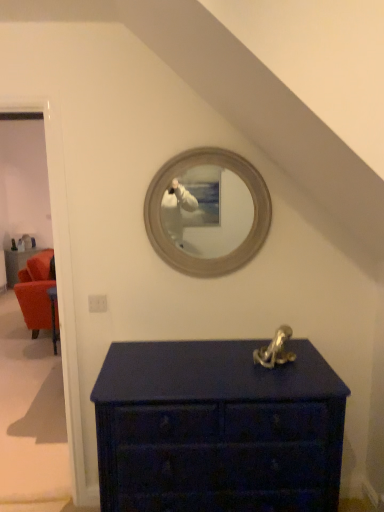
This screenshot has height=512, width=384. I want to click on matte white door at left, so click(60, 271).

What do you see at coordinates (217, 429) in the screenshot?
I see `matte dark blue chest of drawers at lower center` at bounding box center [217, 429].

In order to click on matte white door at left in this screenshot , I will do `click(60, 271)`.

In terms of width, does velvet orange armchair at left look wider or thinner when compared to matte dark blue chest of drawers at lower center?

In the image, velvet orange armchair at left appears to be more narrow than matte dark blue chest of drawers at lower center.

Is the depth of velvet orange armchair at left less than that of matte dark blue chest of drawers at lower center?

No, velvet orange armchair at left is behind matte dark blue chest of drawers at lower center.

Is velvet orange armchair at left far away from matte dark blue chest of drawers at lower center?

That's right, there is a large distance between velvet orange armchair at left and matte dark blue chest of drawers at lower center.

From the image's perspective, is matte white door at left above or below matte dark blue chest of drawers at lower center?

matte white door at left is above matte dark blue chest of drawers at lower center.

What's the angular difference between matte white door at left and matte dark blue chest of drawers at lower center's facing directions?

The facing directions of matte white door at left and matte dark blue chest of drawers at lower center are 1.58 degrees apart.

Which point is more forward, (66, 339) or (119, 449)?

The point (119, 449) is closer.

Is matte dark blue chest of drawers at lower center a part of matte white door at left?

Definitely not — matte dark blue chest of drawers at lower center is not inside matte white door at left.

Consider the image. Who is taller, matte dark blue chest of drawers at lower center or matte white door at left?

Standing taller between the two is matte white door at left.

Which of these two, matte dark blue chest of drawers at lower center or matte white door at left, is bigger?

matte dark blue chest of drawers at lower center.

Are matte dark blue chest of drawers at lower center and matte white door at left beside each other?

They are not placed beside each other.

Where is `chest of drawers below the matte white door at left (from a real-world perspective)`? chest of drawers below the matte white door at left (from a real-world perspective) is located at coordinates pos(217,429).

Is velvet orange armchair at left inside or outside of matte white door at left?

velvet orange armchair at left lies outside matte white door at left.

Is velvet orange armchair at left turned away from matte white door at left?

No, velvet orange armchair at left's orientation is not away from matte white door at left.

I want to click on furniture below the matte white door at left (from a real-world perspective), so click(17, 263).

Between velvet orange armchair at left and matte white door at left, which one appears on the left side from the viewer's perspective?

velvet orange armchair at left.

Is matte white door at left at the right side of velvet orange armchair at left?

Correct, you'll find matte white door at left to the right of velvet orange armchair at left.

From the picture: How distant is matte white door at left from velvet orange armchair at left?

matte white door at left is 13.51 feet from velvet orange armchair at left.

From the picture: Is matte white door at left not near velvet orange armchair at left?

Yes, matte white door at left and velvet orange armchair at left are located far from each other.

Is matte white door at left positioned with its back to velvet orange armchair at left?

That's not correct — matte white door at left is not looking away from velvet orange armchair at left.

What's the angular difference between matte dark blue chest of drawers at lower center and velvet orange armchair at left's facing directions?

The angular difference between matte dark blue chest of drawers at lower center and velvet orange armchair at left is 44.4 degrees.

From a real-world perspective, is matte dark blue chest of drawers at lower center under velvet orange armchair at left?

No, from a real-world perspective, matte dark blue chest of drawers at lower center is not below velvet orange armchair at left.

Is point (206, 348) more distant than point (7, 262)?

No.

This screenshot has height=512, width=384. In order to click on furniture behind the matte dark blue chest of drawers at lower center in this screenshot , I will do `click(17, 263)`.

At what (x,y) coordinates should I click in order to perform the action: click on the chest of drawers below the matte white door at left (from a real-world perspective). Please return your answer as a coordinate pair (x, y). The height and width of the screenshot is (512, 384). Looking at the image, I should click on (217, 429).

Looking at the image, which one is located closer to matte dark blue chest of drawers at lower center, matte white door at left or velvet orange armchair at left?

matte white door at left is closer to matte dark blue chest of drawers at lower center.

Looking at this image, when comparing their distances from matte dark blue chest of drawers at lower center, does velvet orange armchair at left or matte white door at left seem further?

The object further to matte dark blue chest of drawers at lower center is velvet orange armchair at left.

When comparing their distances from velvet orange armchair at left, does matte white door at left or matte dark blue chest of drawers at lower center seem further?

The object further to velvet orange armchair at left is matte dark blue chest of drawers at lower center.

Based on their spatial positions, is matte dark blue chest of drawers at lower center or velvet orange armchair at left closer to matte white door at left?

matte dark blue chest of drawers at lower center lies closer to matte white door at left than the other object.

Based on their spatial positions, is matte dark blue chest of drawers at lower center or matte white door at left further from velvet orange armchair at left?

Based on the image, matte dark blue chest of drawers at lower center appears to be further to velvet orange armchair at left.

Looking at the image, which one is located further to matte white door at left, velvet orange armchair at left or matte dark blue chest of drawers at lower center?

velvet orange armchair at left lies further to matte white door at left than the other object.

Where is `door between matte dark blue chest of drawers at lower center and velvet orange armchair at left along the z-axis`? door between matte dark blue chest of drawers at lower center and velvet orange armchair at left along the z-axis is located at coordinates (60, 271).